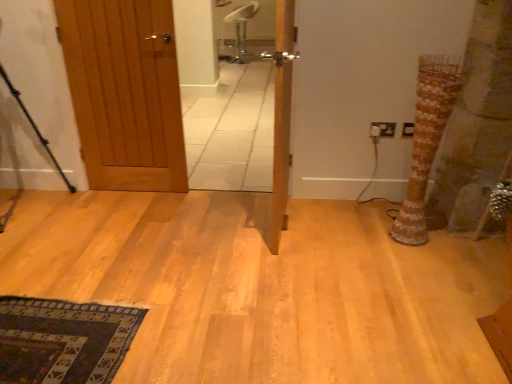
Question: Is white plastic chair at upper center in front of or behind black metal tripod at left in the image?

Choices:
 (A) behind
 (B) front

Answer: (A)

Question: Is point (254, 6) positioned closer to the camera than point (33, 125)?

Choices:
 (A) closer
 (B) farther

Answer: (B)

Question: Estimate the real-world distances between objects in this image. Which object is farther from the white plastic electric outlet at upper right, positioned as the first electric outlet in right-to-left order?

Choices:
 (A) wooden door at left, the 1th door viewed from the left
 (B) white plastic chair at upper center
 (C) striped fabric tree trunk at right
 (D) black metal tripod at left
 (E) wooden door at center, which is counted as the second door, starting from the left

Answer: (B)

Question: Estimate the real-world distances between objects in this image. Which object is closer to the white plastic electric outlet at upper right, positioned as the first electric outlet in right-to-left order?

Choices:
 (A) striped fabric tree trunk at right
 (B) white plastic electric outlet at right, the first electric outlet viewed from the left
 (C) white plastic chair at upper center
 (D) wooden door at left, the 1th door viewed from the left
 (E) black metal tripod at left

Answer: (B)